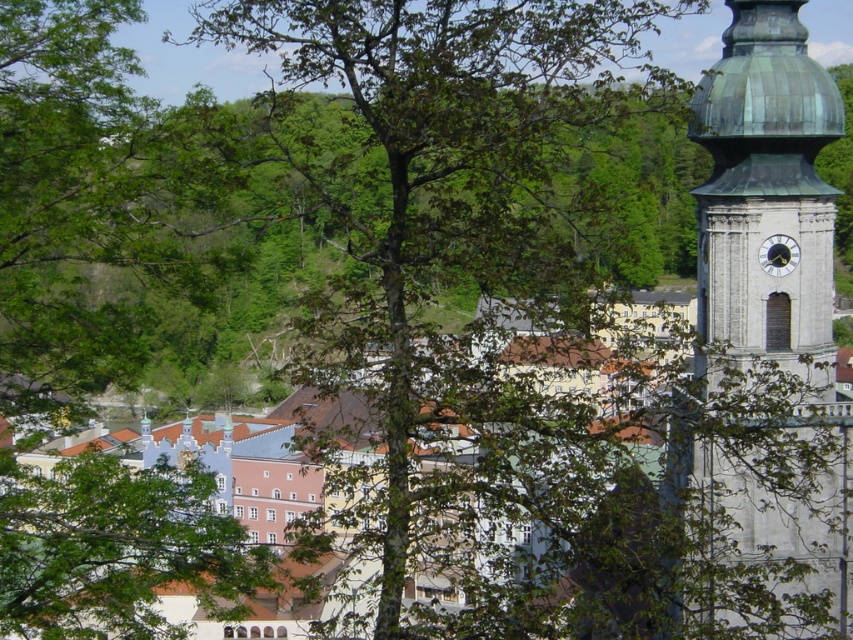
Based on the scene description, which object is wider between the green copper dome at right and the white metallic clock at upper right?

The green copper dome at right is wider than the white metallic clock at upper right according to the description.

You are standing in the town square and want to take a photo of the green copper dome at right. However, the dense foliage of the tree in the foreground is blocking your view. Based on the coordinates provided, can you determine if the dome is visible from your current position?

The green copper dome at right is located at point [767,195]. Since the tree is in the foreground and partially obscures the view, it is possible that the dome is still visible depending on the exact positioning. However, without additional information about the tree canopy coverage, it is uncertain if the dome is fully visible.